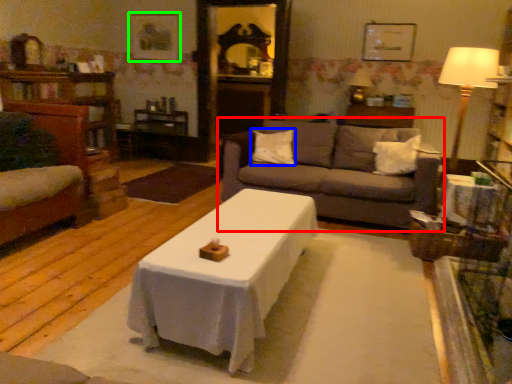
Question: Which object is the closest to the studio couch (highlighted by a red box)? Choose among these: pillow (highlighted by a blue box) or picture frame (highlighted by a green box).

Choices:
 (A) pillow
 (B) picture frame

Answer: (A)